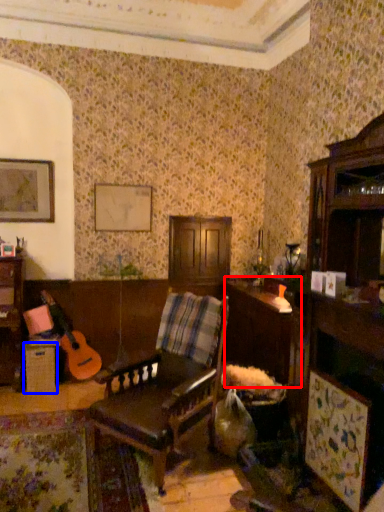
Question: Which object is further to the camera taking this photo, table (highlighted by a red box) or table (highlighted by a blue box)?

Choices:
 (A) table
 (B) table

Answer: (B)